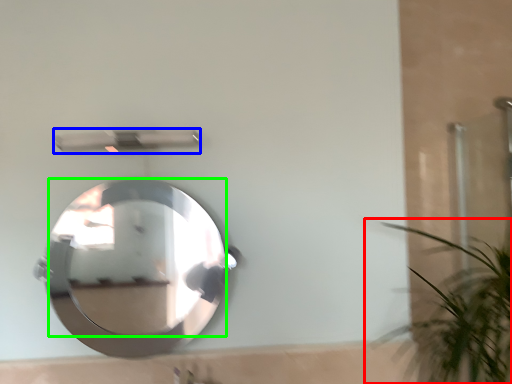
Question: Which object is the farthest from houseplant (highlighted by a red box)? Choose among these: shower (highlighted by a blue box) or mirror (highlighted by a green box).

Choices:
 (A) shower
 (B) mirror

Answer: (B)